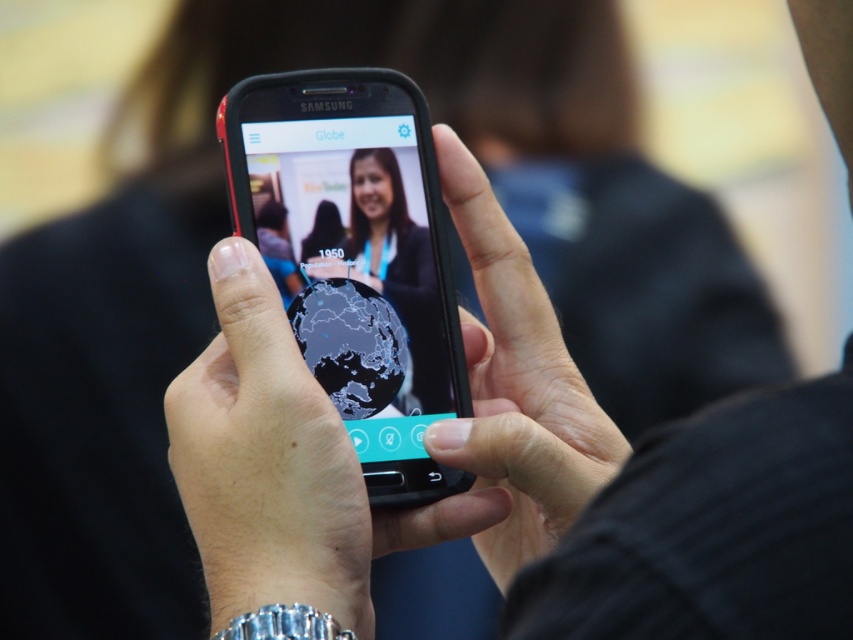
Is black matte phone at center wider than matte black globe at center?

Yes.

Who is more forward, (289, 589) or (364, 161)?

Positioned in front is point (289, 589).

This screenshot has height=640, width=853. In order to click on black matte phone at center in this screenshot , I will do `click(283, 467)`.

Is black glossy phone at center shorter than smooth skin hand at center?

Indeed, black glossy phone at center has a lesser height compared to smooth skin hand at center.

In the scene shown: Which is above, black glossy phone at center or smooth skin hand at center?

black glossy phone at center

Where is `black glossy phone at center`? This screenshot has width=853, height=640. black glossy phone at center is located at coordinates (357, 257).

Locate an element on the screen. black glossy phone at center is located at coordinates (357, 257).

Is point (297, 464) in front of point (543, 552)?

Yes.

From the picture: Does black matte phone at center appear on the right side of smooth skin hand at center?

No, black matte phone at center is not to the right of smooth skin hand at center.

Which is in front, point (358, 547) or point (488, 467)?

Point (358, 547)

What are the coordinates of `black matte phone at center` in the screenshot? It's located at (283, 467).